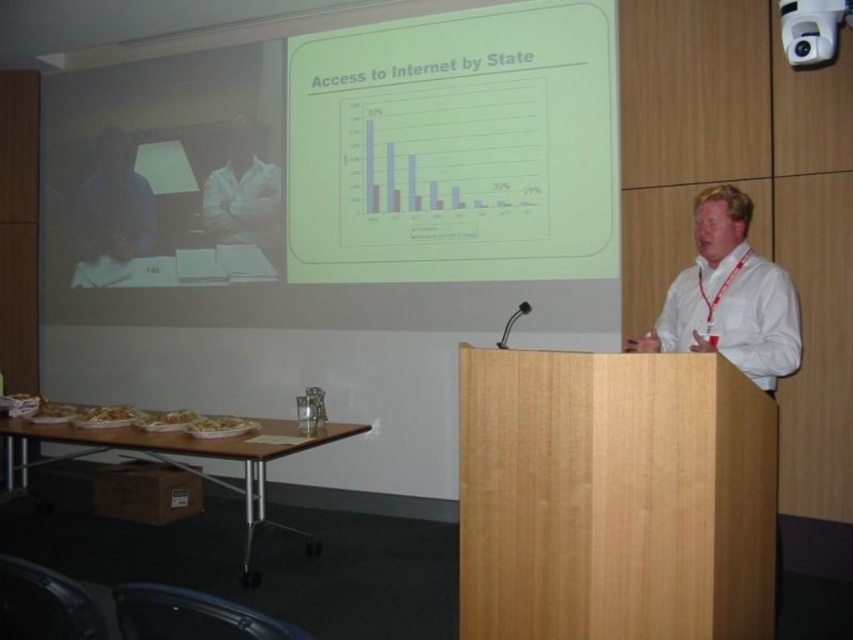
You are sitting in the front row of the conference room and want to see the white matte projection screen at upper center clearly. The screen is 13.62 feet away from you. If your optimal viewing distance for such screens is 12 feet, is the screen too far away for comfortable viewing?

The white matte projection screen at upper center is 13.62 feet away from the viewer, which is slightly beyond the optimal 12 feet distance. This might make it a bit challenging to view the screen comfortably from the front row.